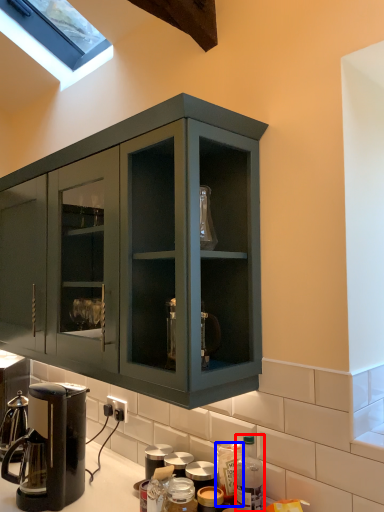
Question: Which point is further to the camera, bottle (highlighted by a red box) or bottle (highlighted by a blue box)?

Choices:
 (A) bottle
 (B) bottle

Answer: (B)